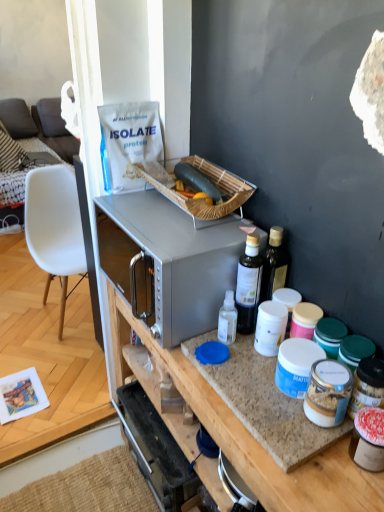
Identify the location of vacant space in front of green matte zucchini at center. (192, 227).